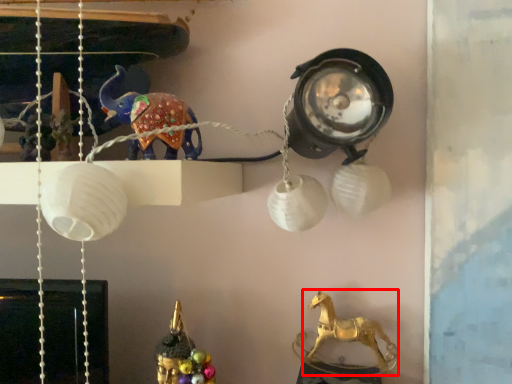
Question: From the image's perspective, considering the relative positions of animal (annotated by the red box) and animal in the image provided, where is animal (annotated by the red box) located with respect to the staircase?

Choices:
 (A) below
 (B) above

Answer: (A)